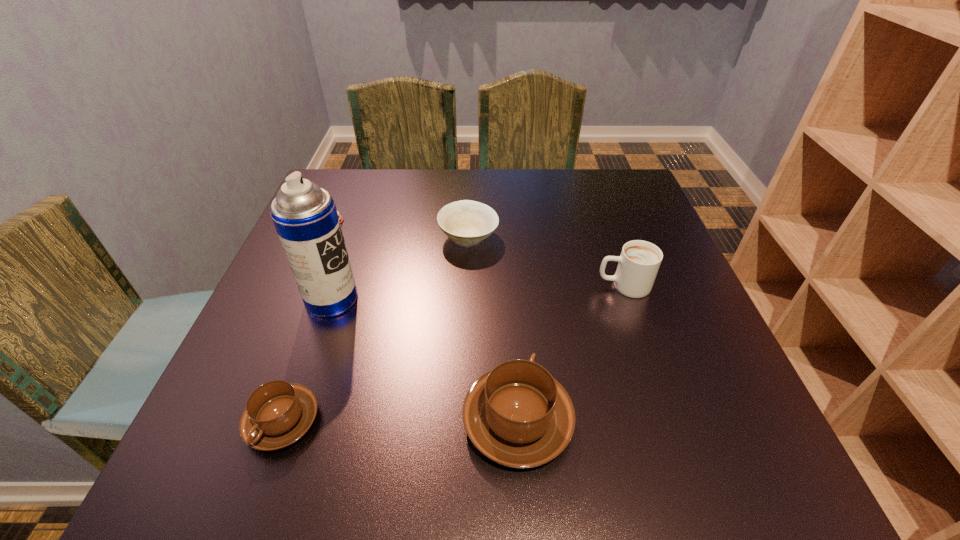
Where is `free area in between the second cappuccino from left to right and the farthest cappuccino`? Image resolution: width=960 pixels, height=540 pixels. free area in between the second cappuccino from left to right and the farthest cappuccino is located at coordinates (570, 353).

Find the location of `vacant area that lies between the bowl and the aerosol can`. vacant area that lies between the bowl and the aerosol can is located at coordinates (400, 268).

Image resolution: width=960 pixels, height=540 pixels. Find the location of `free space between the shortest object and the leftmost cappuccino`. free space between the shortest object and the leftmost cappuccino is located at coordinates (308, 321).

At what (x,y) coordinates should I click in order to perform the action: click on free space between the tallest object and the shortest cappuccino. Please return your answer as a coordinate pair (x, y). The width and height of the screenshot is (960, 540). Looking at the image, I should click on (307, 360).

The width and height of the screenshot is (960, 540). I want to click on free space between the leftmost cappuccino and the chocolate cake, so point(308,321).

This screenshot has height=540, width=960. In order to click on free spot between the tallest object and the shortest cappuccino in this screenshot , I will do `click(307, 360)`.

This screenshot has width=960, height=540. Find the location of `free space between the shortest object and the second cappuccino from right to left`. free space between the shortest object and the second cappuccino from right to left is located at coordinates (425, 321).

Identify the location of free space between the tallest object and the bowl. Image resolution: width=960 pixels, height=540 pixels. (400, 268).

At what (x,y) coordinates should I click in order to perform the action: click on free spot between the chocolate cake and the rightmost object. Please return your answer as a coordinate pair (x, y). The height and width of the screenshot is (540, 960). Looking at the image, I should click on (478, 253).

Identify which object is the second nearest to the rightmost object. Please provide its 2D coordinates. Your answer should be formatted as a tuple, i.e. [(x, y)], where the tuple contains the x and y coordinates of a point satisfying the conditions above.

[(466, 222)]